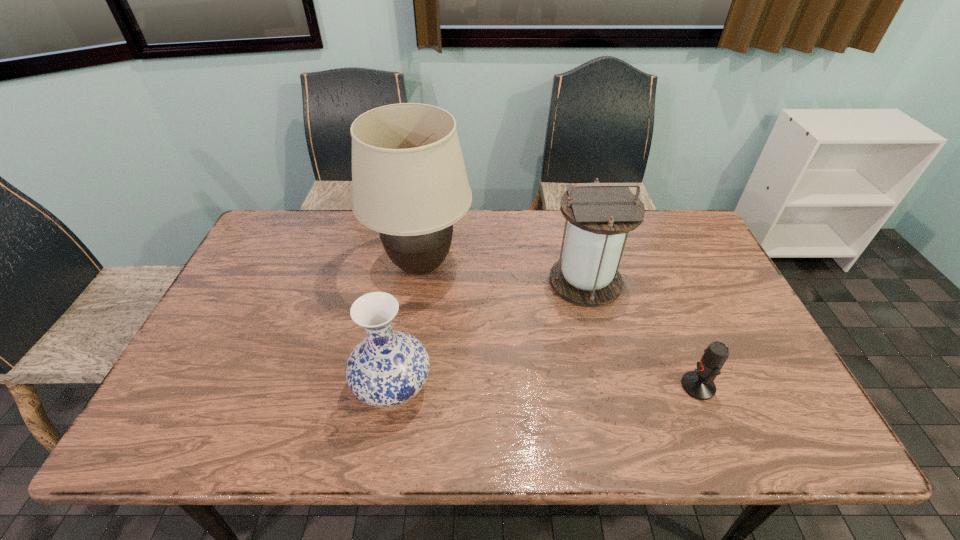
Select which object is the third closest to the vase. Please provide its 2D coordinates. Your answer should be formatted as a tuple, i.e. [(x, y)], where the tuple contains the x and y coordinates of a point satisfying the conditions above.

[(699, 384)]

Identify the location of free space that satisfies the following two spatial constraints: 1. on the back side of the third tallest object; 2. on the right side of the third shortest object. [x=411, y=281].